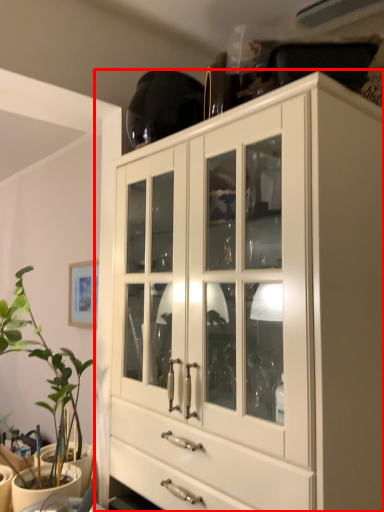
Question: In this image, where is cabinetry (annotated by the red box) located relative to houseplant?

Choices:
 (A) right
 (B) left

Answer: (A)